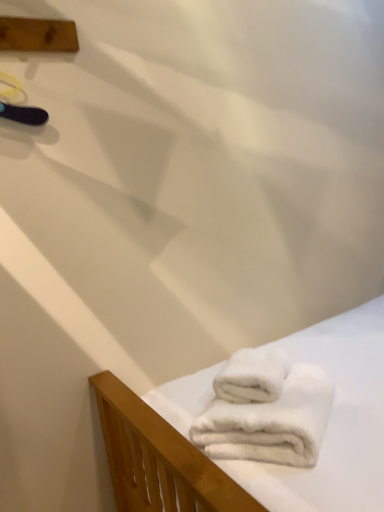
Question: Is white fluffy towels at lower right, positioned as the second towel in top-to-bottom order, smaller than wooden plank at upper left?

Choices:
 (A) no
 (B) yes

Answer: (A)

Question: Considering the relative positions of white fluffy towels at lower right, positioned as the second towel in top-to-bottom order, and wooden plank at upper left in the image provided, is white fluffy towels at lower right, positioned as the second towel in top-to-bottom order, to the right of wooden plank at upper left from the viewer's perspective?

Choices:
 (A) no
 (B) yes

Answer: (B)

Question: Does white fluffy towels at lower right, positioned as the second towel in top-to-bottom order, turn towards wooden plank at upper left?

Choices:
 (A) no
 (B) yes

Answer: (A)

Question: Can you confirm if white fluffy towels at lower right, positioned as the second towel in top-to-bottom order, is positioned to the left of wooden plank at upper left?

Choices:
 (A) no
 (B) yes

Answer: (A)

Question: From the image's perspective, is white fluffy towels at lower right, which ranks as the first towel in bottom-to-top order, located above wooden plank at upper left?

Choices:
 (A) yes
 (B) no

Answer: (B)

Question: Considering the positions of wooden plank at upper left and white fluffy towels at lower right, positioned as the second towel in top-to-bottom order, in the image, is wooden plank at upper left taller or shorter than white fluffy towels at lower right, positioned as the second towel in top-to-bottom order,?

Choices:
 (A) short
 (B) tall

Answer: (A)

Question: Based on their positions, is wooden plank at upper left located to the left or right of white fluffy towels at lower right, which ranks as the first towel in bottom-to-top order?

Choices:
 (A) left
 (B) right

Answer: (A)

Question: From the image's perspective, relative to white fluffy towels at lower right, positioned as the second towel in top-to-bottom order, is wooden plank at upper left above or below?

Choices:
 (A) below
 (B) above

Answer: (B)

Question: Looking at the image, does wooden plank at upper left seem bigger or smaller compared to white fluffy towels at lower right, which ranks as the first towel in bottom-to-top order?

Choices:
 (A) big
 (B) small

Answer: (B)

Question: Considering their positions, is white fluffy towels at lower right, which ranks as the first towel in bottom-to-top order, located in front of or behind wooden plank at upper left?

Choices:
 (A) front
 (B) behind

Answer: (A)

Question: From a real-world perspective, relative to wooden plank at upper left, is white fluffy towels at lower right, positioned as the second towel in top-to-bottom order, vertically above or below?

Choices:
 (A) above
 (B) below

Answer: (B)

Question: Does point (243, 443) appear closer or farther from the camera than point (67, 27)?

Choices:
 (A) closer
 (B) farther

Answer: (A)

Question: In terms of width, does white fluffy towels at lower right, which ranks as the first towel in bottom-to-top order, look wider or thinner when compared to wooden plank at upper left?

Choices:
 (A) wide
 (B) thin

Answer: (A)

Question: From the image's perspective, is white fluffy towel at lower right, acting as the second towel starting from the bottom, positioned above or below wooden plank at upper left?

Choices:
 (A) above
 (B) below

Answer: (B)

Question: Is white fluffy towel at lower right, acting as the second towel starting from the bottom, spatially inside wooden plank at upper left, or outside of it?

Choices:
 (A) inside
 (B) outside

Answer: (B)